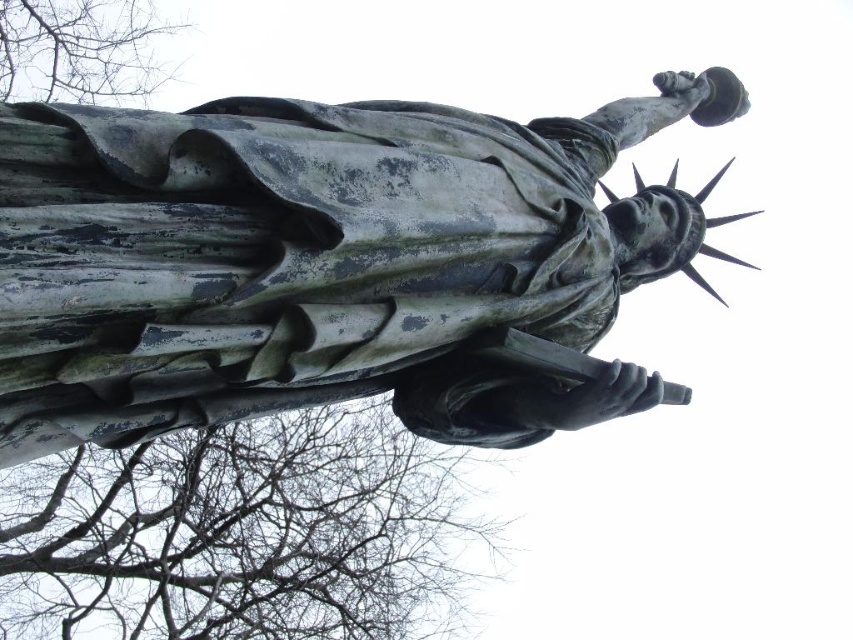
You are standing at the base of the Statue of Liberty and notice two points marked on the statue. The first point is at coordinate point(x=9, y=349) and the second is at point(x=68, y=52). Which point is closer to you?

Point(x=9, y=349) is closer to you because it is in front of point(x=68, y=52).

You are standing at the base of the statue and looking upward. There is a point at coordinates point (241, 534). What do you see at that point?

At point (241, 534), there are bare branches at upper center.

You are a photographer trying to capture the green patina statue at center and the bare branches at upper center in the same frame. Based on their positions, can you determine which one is closer to the camera?

The green patina statue at center is positioned over bare branches at upper center, meaning it is closer to the camera than the branches.